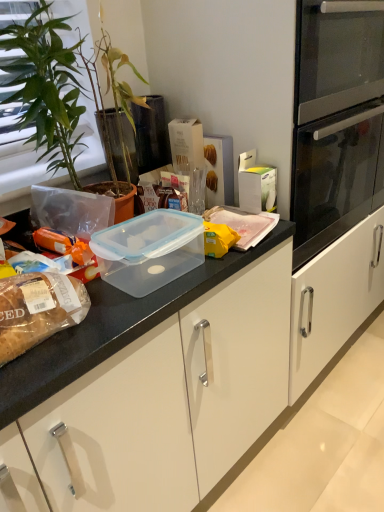
Locate an element on the screen. The width and height of the screenshot is (384, 512). translucent plastic container at center, which is the second food from front to back is located at coordinates (243, 224).

The image size is (384, 512). Find the location of `transparent plastic container at center`. transparent plastic container at center is located at coordinates (149, 250).

Image resolution: width=384 pixels, height=512 pixels. What do you see at coordinates (37, 310) in the screenshot?
I see `translucent plastic bread at left, the second food from the right` at bounding box center [37, 310].

Where is `green leafy plant at left`? Image resolution: width=384 pixels, height=512 pixels. green leafy plant at left is located at coordinates (47, 86).

In order to face transparent plastic container at upper center, should I rotate leftwards or rightwards?

Rotate right and turn 11.230 degrees.

Describe the element at coordinates (281, 98) in the screenshot. I see `transparent plastic container at upper center` at that location.

Identify the location of translucent plastic container at center, the first food when ordered from right to left. (243, 224).

From the picture: Can we say transparent plastic container at upper center lies outside translucent plastic container at center, which appears as the 2th food when viewed from the left?

Indeed, transparent plastic container at upper center is completely outside translucent plastic container at center, which appears as the 2th food when viewed from the left.

Consider the image. From the image's perspective, is transparent plastic container at upper center located beneath translucent plastic container at center, which is the second food from front to back?

Incorrect, from the image's perspective, transparent plastic container at upper center is higher than translucent plastic container at center, which is the second food from front to back.

Is point (271, 99) farther from camera compared to point (225, 219)?

No, (271, 99) is closer to viewer.

Is transparent plastic container at upper center to the right of translucent plastic container at center, which is the second food from front to back, from the viewer's perspective?

Indeed, transparent plastic container at upper center is positioned on the right side of translucent plastic container at center, which is the second food from front to back.

This screenshot has width=384, height=512. I want to click on houseplant on the left of translucent plastic container at center, the second food ordered from the bottom, so click(x=47, y=86).

Is green leafy plant at left facing towards translucent plastic container at center, the 1th food when ordered from top to bottom?

Yes, green leafy plant at left is turned towards translucent plastic container at center, the 1th food when ordered from top to bottom.

From the image's perspective, which one is positioned lower, green leafy plant at left or translucent plastic container at center, the 1th food when ordered from top to bottom?

translucent plastic container at center, the 1th food when ordered from top to bottom, appears lower in the image.

Considering the positions of points (81, 143) and (262, 213), is point (81, 143) farther from camera compared to point (262, 213)?

No, it is not.

From a real-world perspective, count 2nd foods downward from the transparent plastic container at upper center and point to it. Please provide its 2D coordinates.

[(243, 224)]

From the image's perspective, is translucent plastic container at center, the first food when ordered from right to left, located above or below transparent plastic container at upper center?

translucent plastic container at center, the first food when ordered from right to left, is below transparent plastic container at upper center.

How different are the orientations of translucent plastic container at center, which is the first food in back-to-front order, and transparent plastic container at upper center in degrees?

There is a 0.481-degree angle between the facing directions of translucent plastic container at center, which is the first food in back-to-front order, and transparent plastic container at upper center.

Considering the sizes of objects translucent plastic container at center, which is the second food from front to back, and transparent plastic container at upper center in the image provided, who is bigger, translucent plastic container at center, which is the second food from front to back, or transparent plastic container at upper center?

Bigger between the two is transparent plastic container at upper center.

Does translucent plastic bread at left, which is the 2th food in back-to-front order, come behind transparent plastic container at center?

No, it is in front of transparent plastic container at center.

Between translucent plastic bread at left, the first food from the bottom, and transparent plastic container at center, which one has larger size?

Bigger between the two is transparent plastic container at center.

From a real-world perspective, does translucent plastic bread at left, acting as the first food starting from the left, stand above transparent plastic container at center?

Indeed, from a real-world perspective, translucent plastic bread at left, acting as the first food starting from the left, stands above transparent plastic container at center.

Who is taller, translucent plastic bread at left, the second food positioned from the top, or transparent plastic container at center?

With more height is transparent plastic container at center.

How many degrees apart are the facing directions of green leafy plant at left and transparent plastic container at upper center?

Answer: There is a 6.17-degree angle between the facing directions of green leafy plant at left and transparent plastic container at upper center.

Is green leafy plant at left taller than transparent plastic container at upper center?

No.

Considering their positions, is green leafy plant at left located in front of or behind transparent plastic container at upper center?

green leafy plant at left is positioned closer to the viewer than transparent plastic container at upper center.

Is green leafy plant at left beside transparent plastic container at upper center?

No.

Is the depth of transparent plastic container at center less than that of transparent plastic container at upper center?

Yes, transparent plastic container at center is closer to the viewer.

Considering the sizes of transparent plastic container at center and transparent plastic container at upper center in the image, is transparent plastic container at center taller or shorter than transparent plastic container at upper center?

Considering their sizes, transparent plastic container at center has less height than transparent plastic container at upper center.

Is transparent plastic container at center oriented away from transparent plastic container at upper center?

No, transparent plastic container at center is not facing the opposite direction of transparent plastic container at upper center.

Is transparent plastic container at upper center spatially inside green leafy plant at left, or outside of it?

transparent plastic container at upper center is not enclosed by green leafy plant at left.

From a real-world perspective, is transparent plastic container at upper center physically below green leafy plant at left?

Yes.

Is point (346, 141) positioned after point (90, 76)?

Yes, point (346, 141) is behind point (90, 76).

The image size is (384, 512). What are the coordinates of `food located behind the transparent plastic container at upper center` in the screenshot? It's located at (243, 224).

You are a GUI agent. You are given a task and a screenshot of the screen. Output one action in this format:
    pyautogui.click(x=<x>, y=<y>)
    Task: Click on the 1st food below the green leafy plant at left (from the image's perspective)
    Image resolution: width=384 pixels, height=512 pixels.
    Given the screenshot: What is the action you would take?
    (243, 224)

Considering their positions, is translucent plastic bread at left, acting as the first food starting from the left, positioned closer to translucent plastic container at center, which is the first food in back-to-front order, than green leafy plant at left?

Among the two, green leafy plant at left is located nearer to translucent plastic container at center, which is the first food in back-to-front order.

Estimate the real-world distances between objects in this image. Which object is further from translucent plastic bread at left, the first food from the bottom, translucent plastic container at center, which is the first food in back-to-front order, or transparent plastic container at upper center?

transparent plastic container at upper center lies further to translucent plastic bread at left, the first food from the bottom, than the other object.

When comparing their distances from translucent plastic bread at left, the first food from the bottom, does transparent plastic container at center or transparent plastic container at upper center seem further?

transparent plastic container at upper center is further to translucent plastic bread at left, the first food from the bottom.

Considering their positions, is transparent plastic container at upper center positioned further to green leafy plant at left than transparent plastic container at center?

transparent plastic container at upper center lies further to green leafy plant at left than the other object.

Estimate the real-world distances between objects in this image. Which object is closer to translucent plastic bread at left, the first food from the bottom, green leafy plant at left or transparent plastic container at center?

transparent plastic container at center is closer to translucent plastic bread at left, the first food from the bottom.

Looking at the image, which one is located further to translucent plastic bread at left, the second food positioned from the top, green leafy plant at left or translucent plastic container at center, which is the second food from front to back?

translucent plastic container at center, which is the second food from front to back, lies further to translucent plastic bread at left, the second food positioned from the top, than the other object.

Looking at the image, which one is located closer to translucent plastic container at center, the 1th food when ordered from top to bottom, transparent plastic container at center or translucent plastic bread at left, the second food from the right?

Based on the image, transparent plastic container at center appears to be nearer to translucent plastic container at center, the 1th food when ordered from top to bottom.

Considering their positions, is green leafy plant at left positioned further to translucent plastic container at center, which is the first food in back-to-front order, than translucent plastic bread at left, the second food positioned from the top?

translucent plastic bread at left, the second food positioned from the top, is positioned further to the anchor translucent plastic container at center, which is the first food in back-to-front order.

You are a GUI agent. You are given a task and a screenshot of the screen. Output one action in this format:
    pyautogui.click(x=<x>, y=<y>)
    Task: Click on the food between transparent plastic container at upper center and transparent plastic container at center in the up-down direction
    The image size is (384, 512).
    Given the screenshot: What is the action you would take?
    [243, 224]

The image size is (384, 512). In order to click on appliance situated between translucent plastic bread at left, which is the 2th food in back-to-front order, and transparent plastic container at upper center from left to right in this screenshot , I will do `click(149, 250)`.

What are the coordinates of `houseplant between translucent plastic bread at left, the second food from the right, and transparent plastic container at upper center` in the screenshot? It's located at (47, 86).

Identify the location of food between green leafy plant at left and transparent plastic container at upper center in the horizontal direction. Image resolution: width=384 pixels, height=512 pixels. (243, 224).